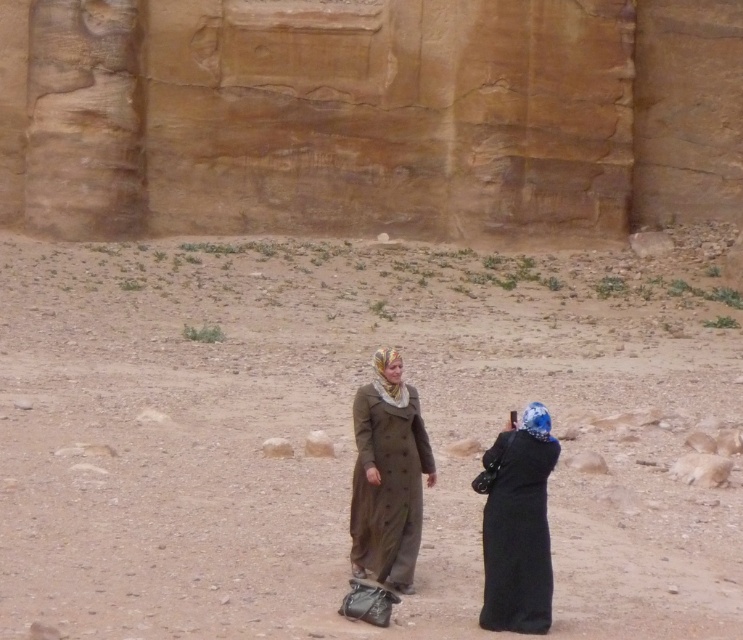
Does dull brown desert at center have a lesser height compared to matte brown coat at center?

No.

Is dull brown desert at center behind matte brown coat at center?

No, it is in front of matte brown coat at center.

What do you see at coordinates (350, 433) in the screenshot? This screenshot has width=743, height=640. I see `dull brown desert at center` at bounding box center [350, 433].

Locate an element on the screen. The image size is (743, 640). dull brown desert at center is located at coordinates (350, 433).

Does matte brown coat at center have a lesser height compared to black matte coat at center?

Incorrect, matte brown coat at center's height does not fall short of black matte coat at center's.

Is point (376, 538) positioned behind point (512, 493)?

That is True.

Which is in front, point (415, 545) or point (525, 424)?

Point (525, 424) is in front.

You are a GUI agent. You are given a task and a screenshot of the screen. Output one action in this format:
    pyautogui.click(x=<x>, y=<y>)
    Task: Click on the matte brown coat at center
    The width and height of the screenshot is (743, 640).
    Given the screenshot: What is the action you would take?
    pyautogui.click(x=386, y=476)

Is dull brown desert at center smaller than black matte coat at center?

No.

Measure the distance between dull brown desert at center and camera.

12.23 meters

Is point (421, 380) farther from viewer compared to point (519, 524)?

Yes, it is.

Identify the location of dull brown desert at center. (350, 433).